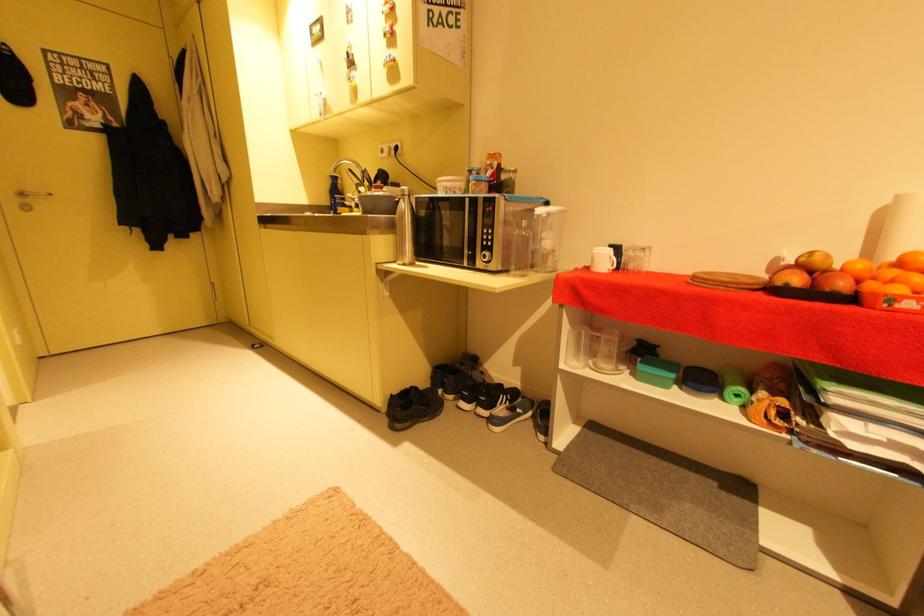
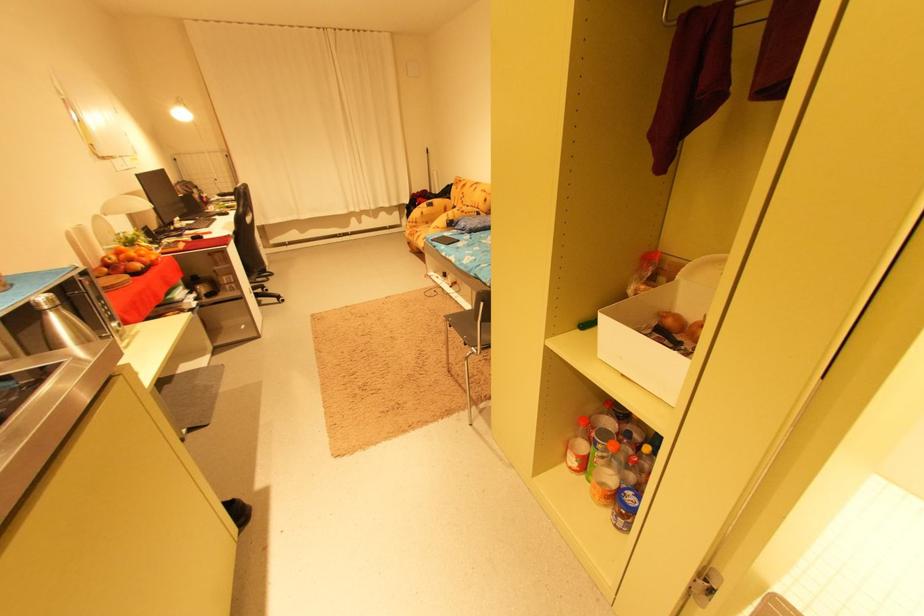
In the second image, find the point that corresponds to point (822, 286) in the first image.

(151, 265)